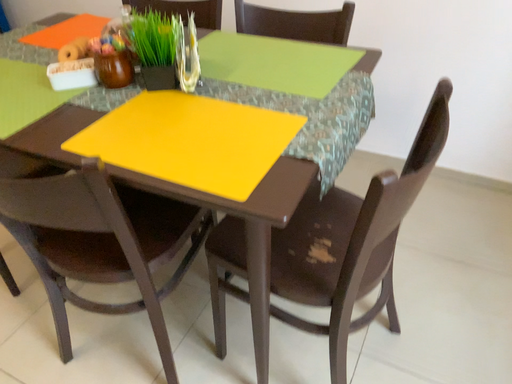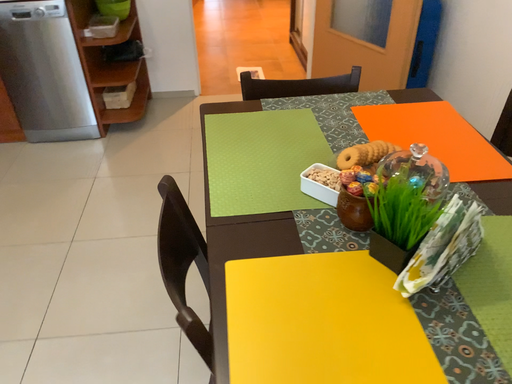
Question: How did the camera likely rotate when shooting the video?

Choices:
 (A) rotated downward
 (B) rotated upward

Answer: (B)